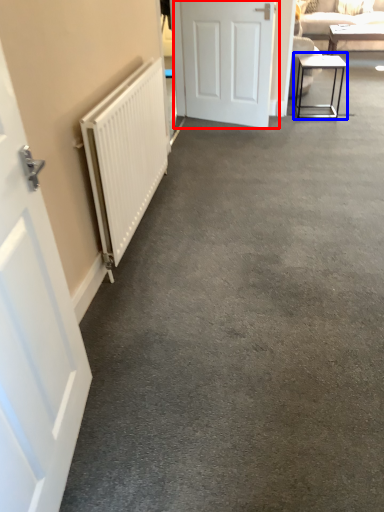
Question: Which of the following is the closest to the observer, door (highlighted by a red box) or table (highlighted by a blue box)?

Choices:
 (A) door
 (B) table

Answer: (A)